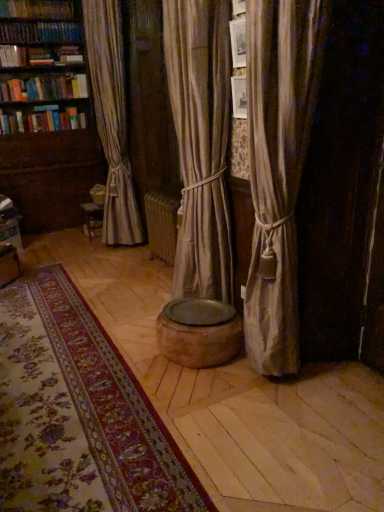
Question: In the image, is wooden bookshelf at left positioned in front of or behind floral carpet at center?

Choices:
 (A) front
 (B) behind

Answer: (B)

Question: Looking at the image, does wooden bookshelf at left seem bigger or smaller compared to floral carpet at center?

Choices:
 (A) big
 (B) small

Answer: (A)

Question: Which of these objects is positioned farthest from the silky beige curtain at right?

Choices:
 (A) wooden bookshelf at left
 (B) floral carpet at center
 (C) hardcover book at upper left

Answer: (C)

Question: Estimate the real-world distances between objects in this image. Which object is closer to the floral carpet at center?

Choices:
 (A) wooden bookshelf at left
 (B) hardcover book at upper left
 (C) silky beige curtain at right

Answer: (C)